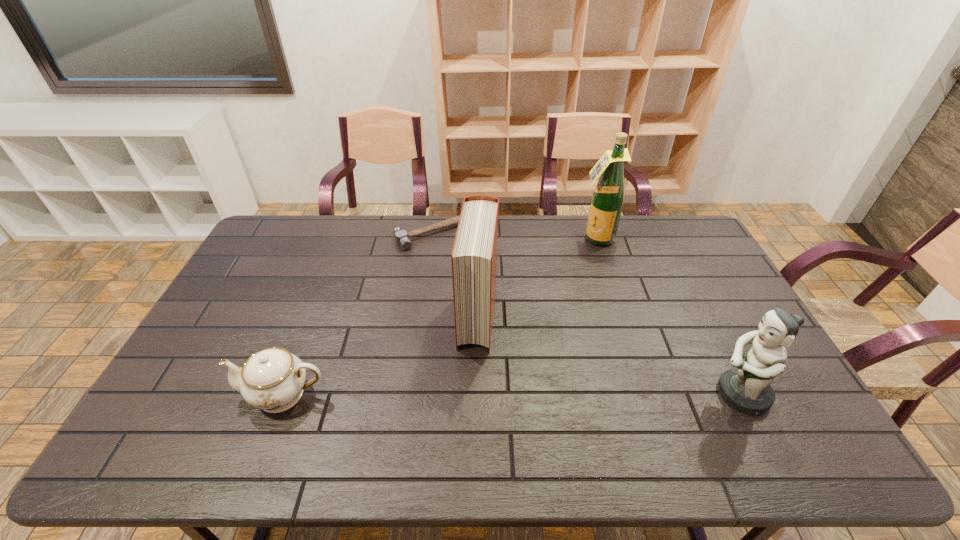
Find the location of a particular element. vacant area situated 0.130m at the spout of the fourth tallest object is located at coordinates (189, 394).

You are a GUI agent. You are given a task and a screenshot of the screen. Output one action in this format:
    pyautogui.click(x=<x>, y=<y>)
    Task: Click on the vacant region located on the front-facing side of the figurine
    
    Given the screenshot: What is the action you would take?
    pyautogui.click(x=684, y=394)

Locate an element on the screen. Image resolution: width=960 pixels, height=540 pixels. vacant space located 0.160m on the front-facing side of the figurine is located at coordinates (651, 394).

This screenshot has height=540, width=960. I want to click on vacant space located 0.080m on the front-facing side of the figurine, so click(681, 394).

Identify the location of vacant region located 0.300m on the striking face of the shortest object. The image size is (960, 540). (495, 300).

I want to click on vacant space located 0.270m on the striking face of the shortest object, so click(x=492, y=294).

This screenshot has height=540, width=960. Find the location of `vacant position located on the striking face of the shortest object`. vacant position located on the striking face of the shortest object is located at coordinates (490, 293).

Where is `blank space located 0.310m on the front-facing side of the second object from right to left`? This screenshot has width=960, height=540. blank space located 0.310m on the front-facing side of the second object from right to left is located at coordinates click(x=571, y=302).

Locate an element on the screen. The height and width of the screenshot is (540, 960). free space located 0.370m on the front-facing side of the second object from right to left is located at coordinates (566, 315).

I want to click on free space located 0.400m on the front-facing side of the second object from right to left, so click(564, 321).